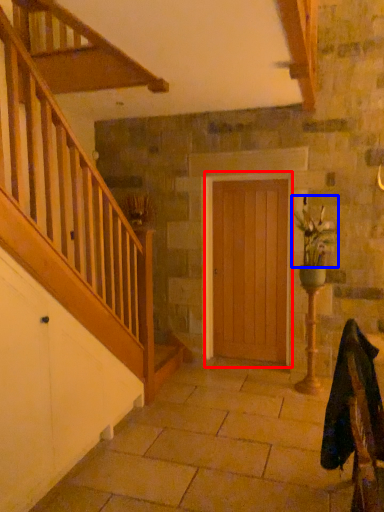
Question: Among these objects, which one is nearest to the camera, door (highlighted by a red box) or floral arrangement (highlighted by a blue box)?

Choices:
 (A) door
 (B) floral arrangement

Answer: (B)